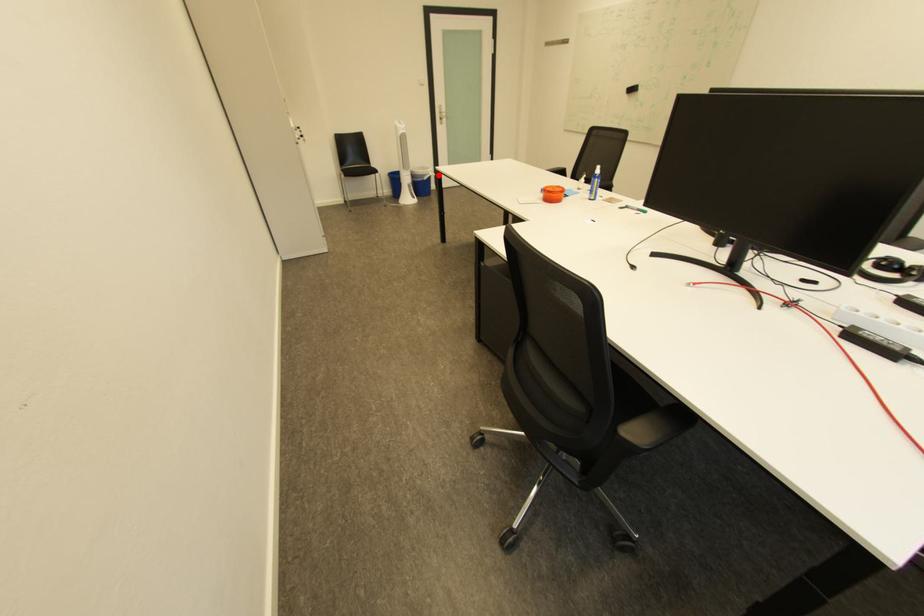
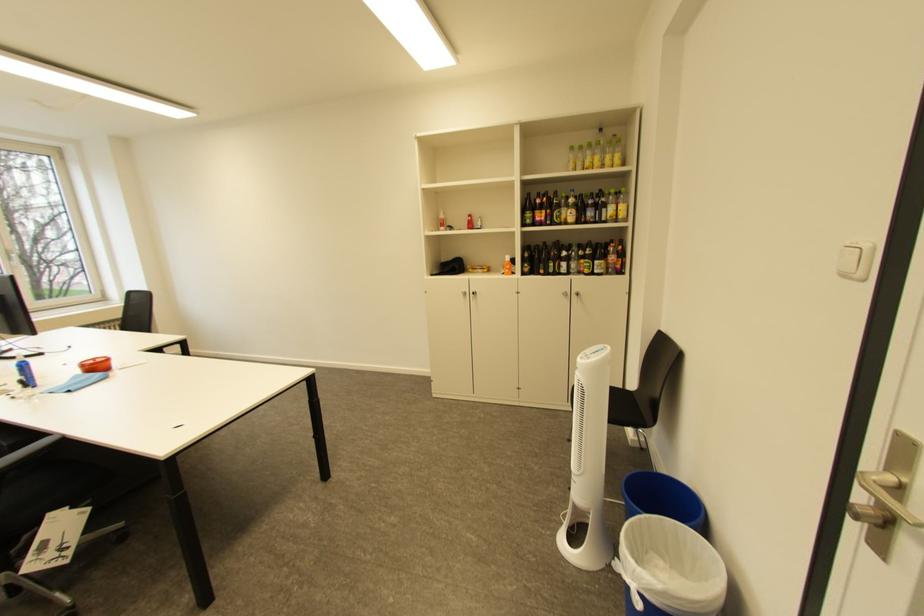
The point at the highlighted location is marked in the first image. Where is the corresponding point in the second image?

(636, 570)